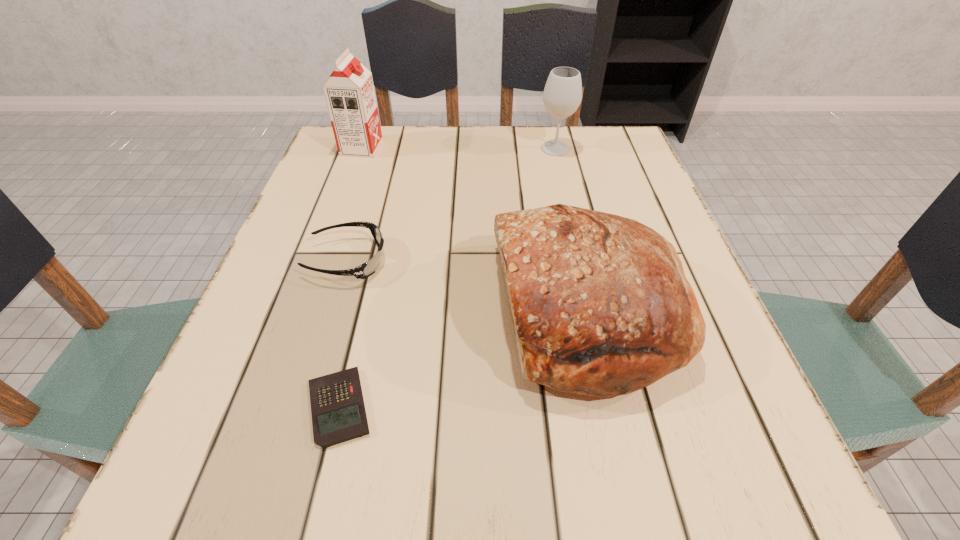
Image resolution: width=960 pixels, height=540 pixels. I want to click on free region located on the lenses of the second shortest object, so click(531, 260).

Locate an element on the screen. The image size is (960, 540). vacant area situated on the right of the shortest object is located at coordinates (490, 407).

The height and width of the screenshot is (540, 960). Identify the location of soya milk located at the far edge. (349, 92).

The width and height of the screenshot is (960, 540). I want to click on wineglass at the far edge, so click(x=562, y=95).

At what (x,y) coordinates should I click in order to perform the action: click on soya milk that is at the left edge. Please return your answer as a coordinate pair (x, y). Looking at the image, I should click on (349, 92).

Identify the location of sunglasses at the left edge. The height and width of the screenshot is (540, 960). (368, 268).

In order to click on calculator that is at the left edge in this screenshot , I will do `click(338, 412)`.

The image size is (960, 540). In order to click on wineglass present at the right edge in this screenshot , I will do `click(562, 95)`.

This screenshot has width=960, height=540. In order to click on bread positioned at the right edge in this screenshot , I will do click(600, 304).

The height and width of the screenshot is (540, 960). Identify the location of object at the far left corner. (349, 92).